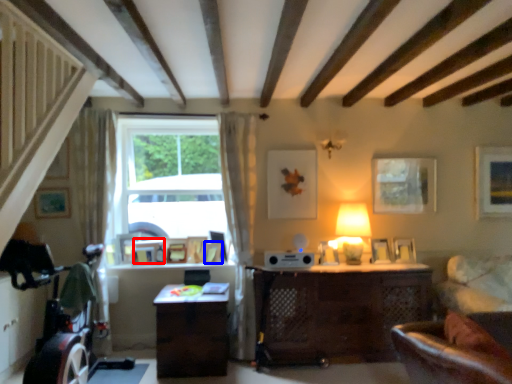
Question: Which object appears closest to the camera in this image, picture frame (highlighted by a red box) or picture frame (highlighted by a blue box)?

Choices:
 (A) picture frame
 (B) picture frame

Answer: (B)